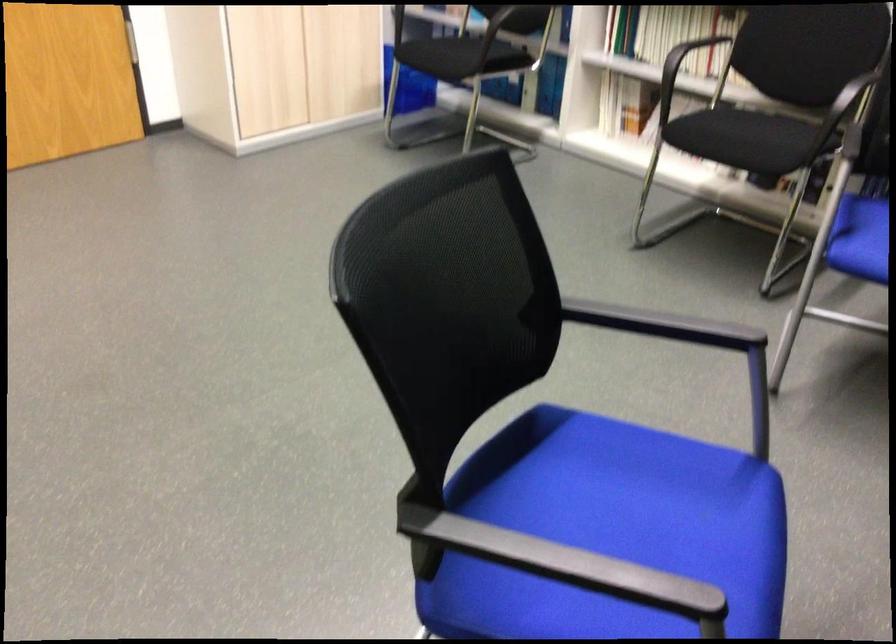
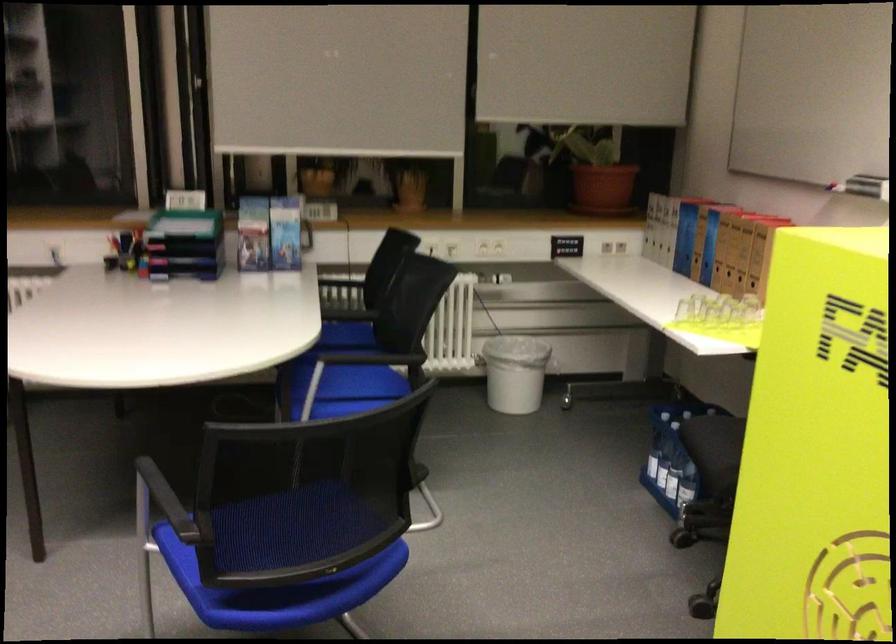
Question: I am providing you with two images of the same scene from different viewpoints. Please identify which objects are invisible in image2.

Choices:
 (A) green organizer tray
 (B) chair sitting surface
 (C) pink dresser drawer
 (D) clear water bottle

Answer: (B)